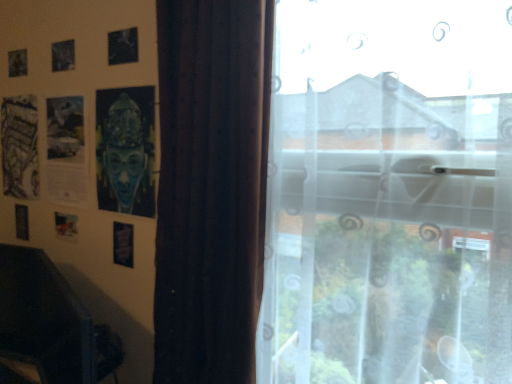
Question: In terms of width, does blue matte mask at upper left look wider or thinner when compared to metallic silver picture frame at lower left?

Choices:
 (A) thin
 (B) wide

Answer: (B)

Question: Does point (136, 153) appear closer or farther from the camera than point (119, 253)?

Choices:
 (A) farther
 (B) closer

Answer: (B)

Question: Which object is positioned farthest from the blue matte mask at upper left?

Choices:
 (A) metallic silver picture frame at lower left
 (B) dark brown textured curtain at center
 (C) black plastic swivel chair at lower left
 (D) transparent sheer curtain at right

Answer: (D)

Question: Which object is the farthest from the blue matte mask at upper left?

Choices:
 (A) black plastic swivel chair at lower left
 (B) dark brown textured curtain at center
 (C) transparent sheer curtain at right
 (D) metallic silver picture frame at lower left

Answer: (C)